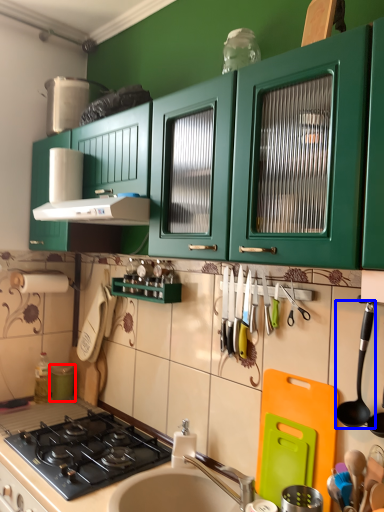
Question: Which object appears farthest to the camera in this image, appliance (highlighted by a red box) or utensil (highlighted by a blue box)?

Choices:
 (A) appliance
 (B) utensil

Answer: (A)